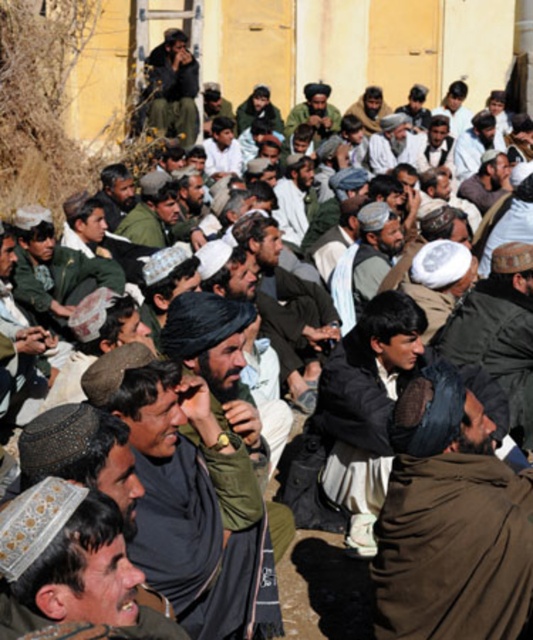
Question: Is dark brown fabric headscarf at center bigger than brown woolen jacket at center?

Choices:
 (A) no
 (B) yes

Answer: (A)

Question: Which point appears closest to the camera in this image?

Choices:
 (A) (148, 115)
 (B) (488, 476)

Answer: (B)

Question: Can you confirm if brown woolen turban at center is bigger than dark brown woolen cap at center?

Choices:
 (A) no
 (B) yes

Answer: (B)

Question: Which of the following is the closest to the observer?

Choices:
 (A) dark brown woolen cap at center
 (B) dark brown fabric headscarf at center

Answer: (B)

Question: Is brown woolen turban at center to the left of dark green uniform at upper center from the viewer's perspective?

Choices:
 (A) yes
 (B) no

Answer: (B)

Question: Which point is closer to the camera?

Choices:
 (A) dark brown woolen cap at center
 (B) brown woolen turban at center
 (C) textured woolen cap at center

Answer: (C)